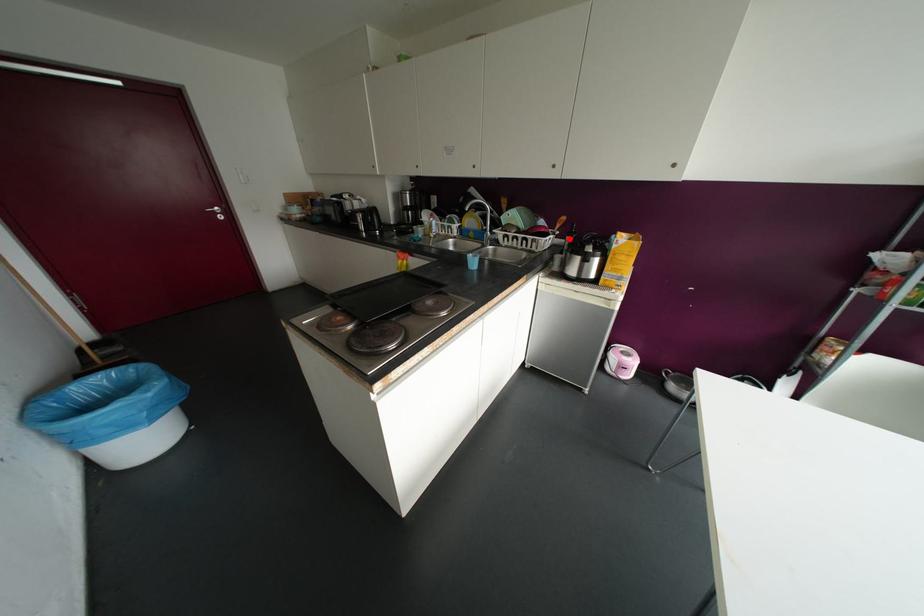
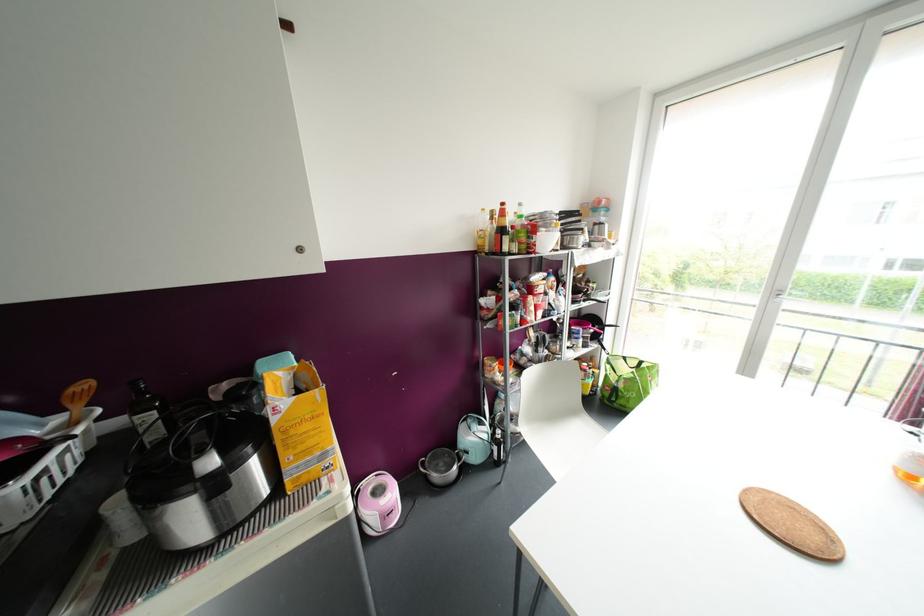
Question: I am providing you with two images of the same scene from different viewpoints. A red point is marked on the first image. Can you still see the location of the red point in image 2?

Choices:
 (A) Yes
 (B) No

Answer: (A)